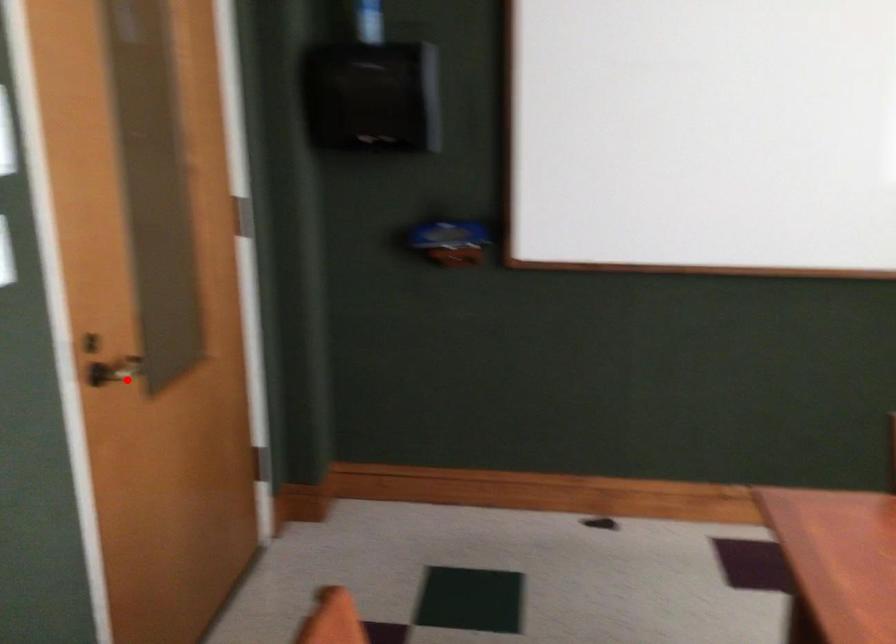
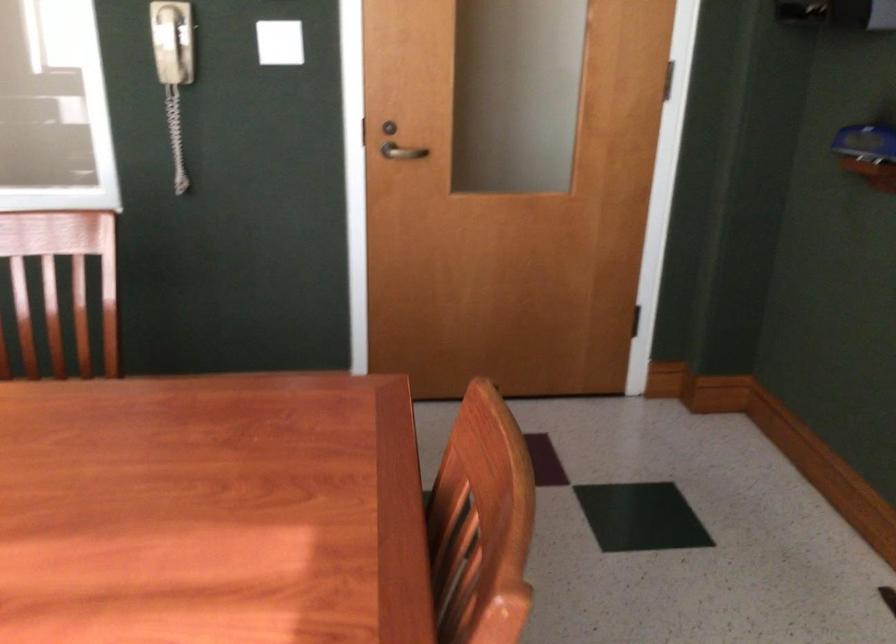
Question: I am providing you with two images of the same scene from different viewpoints. In image1, a red point is highlighted. Considering the same 3D point in image2, which of the following is correct?

Choices:
 (A) It is closer
 (B) It is farther

Answer: (B)